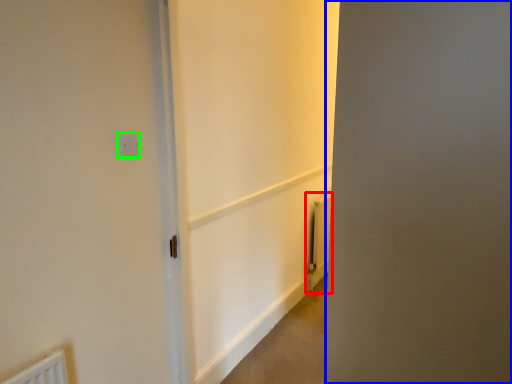
Question: Which object is positioned closest to radiator (highlighted by a red box)? Select from screen door (highlighted by a blue box) and electric outlet (highlighted by a green box).

Choices:
 (A) screen door
 (B) electric outlet

Answer: (B)